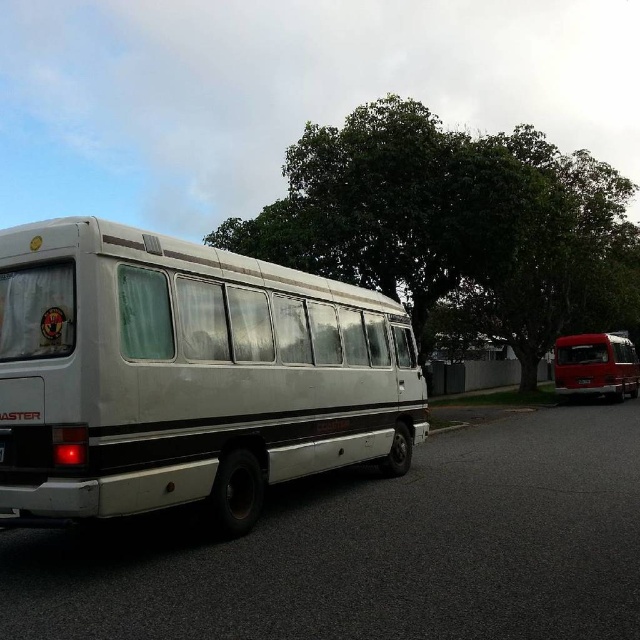
In the scene shown: Can you confirm if white matte bus at center is wider than green leafy tree at center?

No.

Is point (120, 465) closer to viewer compared to point (528, 228)?

Yes.

Locate an element on the screen. The height and width of the screenshot is (640, 640). white matte bus at center is located at coordinates (186, 376).

The height and width of the screenshot is (640, 640). What do you see at coordinates (456, 228) in the screenshot?
I see `green leafy tree at center` at bounding box center [456, 228].

Between point (324, 234) and point (582, 356), which one is positioned in front?

Point (324, 234) is more forward.

Image resolution: width=640 pixels, height=640 pixels. What are the coordinates of `green leafy tree at center` in the screenshot? It's located at (456, 228).

Does white matte bus at center come behind shiny red van at right?

That is False.

Can you confirm if white matte bus at center is thinner than shiny red van at right?

Yes.

Image resolution: width=640 pixels, height=640 pixels. What are the coordinates of `white matte bus at center` in the screenshot? It's located at (186, 376).

Where is `white matte bus at center`? This screenshot has height=640, width=640. white matte bus at center is located at coordinates (186, 376).